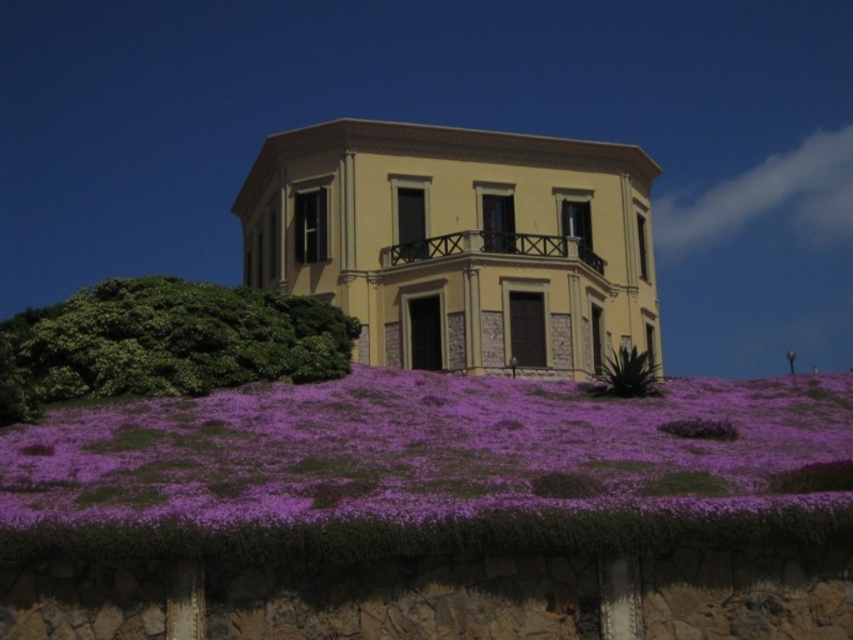
Question: Which point is farther to the camera?

Choices:
 (A) purple soft grass at lower center
 (B) green spiky plant at lower right

Answer: (B)

Question: Can you confirm if purple soft grass at lower center is positioned above green spiky plant at lower right?

Choices:
 (A) no
 (B) yes

Answer: (A)

Question: In this image, where is purple soft grass at lower center located relative to green spiky plant at lower right?

Choices:
 (A) right
 (B) left

Answer: (B)

Question: Does purple soft grass at lower center appear over green spiky plant at lower right?

Choices:
 (A) yes
 (B) no

Answer: (B)